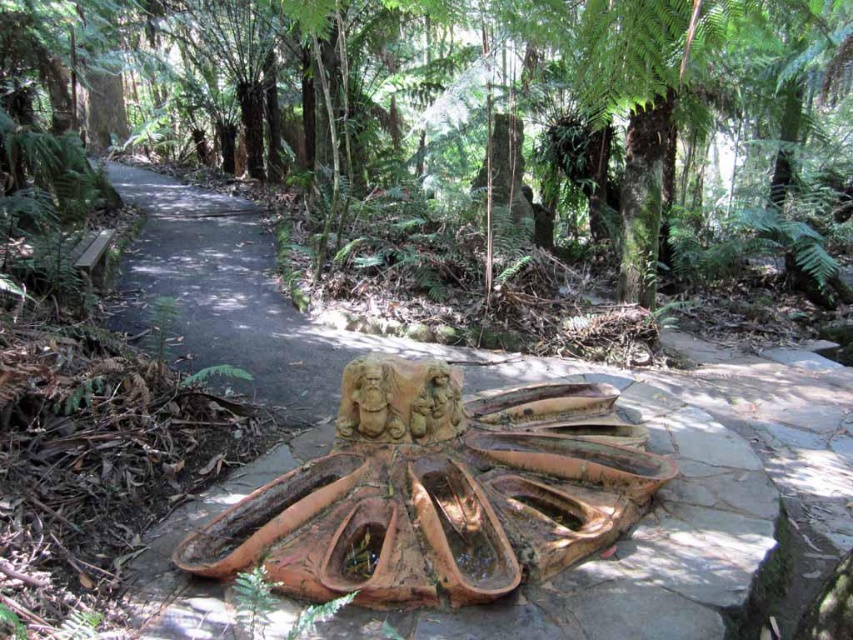
You are a tourist walking along the brown stone path at center and the terracotta stone fountain at center is in the background. Which object is closer to you as you walk?

The brown stone path at center is closer to you because it is in front of the terracotta stone fountain at center, which is further back.

You are a hiker who wants to walk on the brown stone path at center without stepping on the terracotta stone fountain at center. Is this possible?

The brown stone path at center is above the terracotta stone fountain at center, so you can walk on the brown stone path at center without stepping on the terracotta stone fountain at center.

You are a hiker who wants to take a photo of the green mossy tree at center and the terracotta stone fountain at center. Since you have a wide angle lens, you can capture both in one shot. However, you want to make sure that the tree is not blocking the fountain in the photo. Based on their sizes, is this possible?

The green mossy tree at center is larger than the terracotta stone fountain at center, so it might block the fountain in the photo if positioned closely. However, since both are at the center, adjusting the angle could allow capturing both without obstruction.